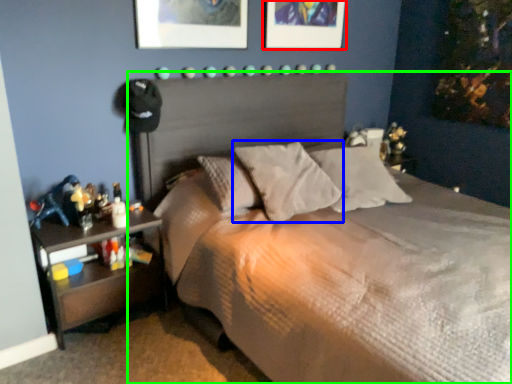
Question: Estimate the real-world distances between objects in this image. Which object is farther from picture frame (highlighted by a red box), pillow (highlighted by a blue box) or bed (highlighted by a green box)?

Choices:
 (A) pillow
 (B) bed

Answer: (B)